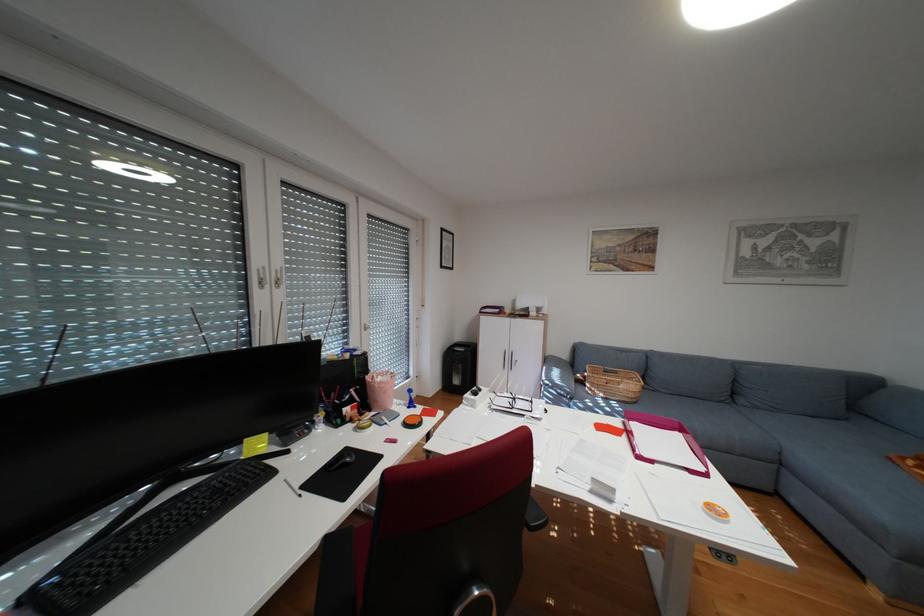
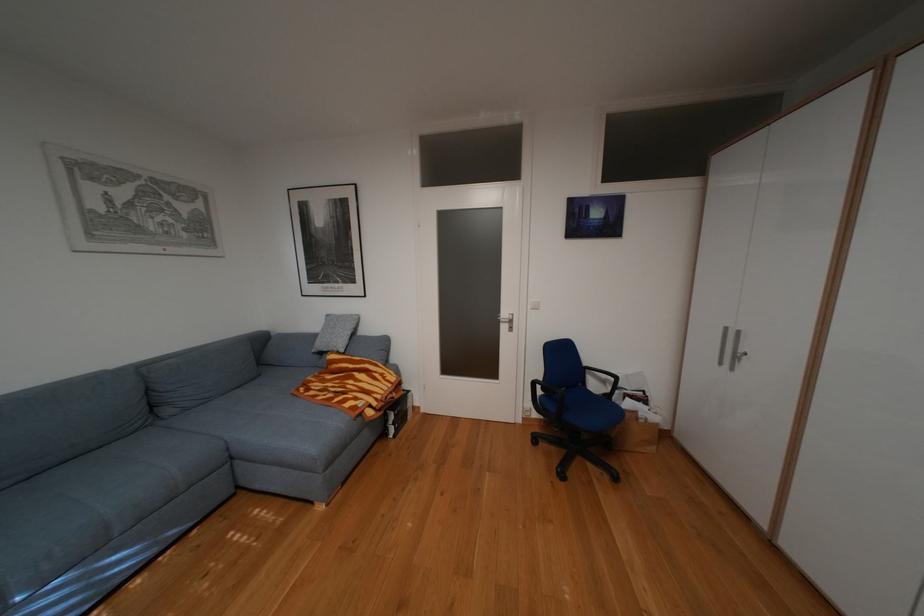
Question: The camera is either moving clockwise (left) or counter-clockwise (right) around the object. The first image is from the beginning of the video and the second image is from the end. Is the camera moving left or right when shooting the video?

Choices:
 (A) Left
 (B) Right

Answer: (A)